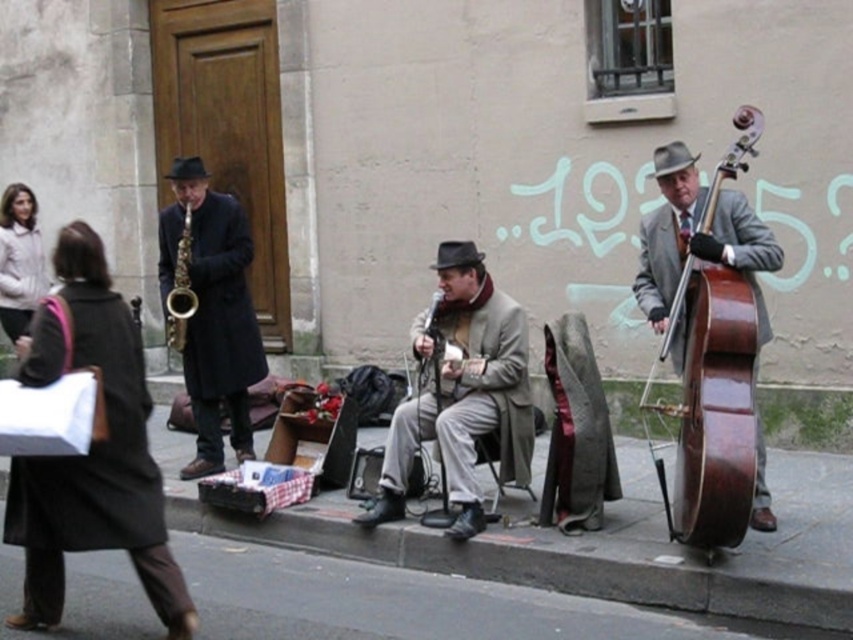
Does point (253, 451) come behind point (178, 346)?

Yes, point (253, 451) is behind point (178, 346).

Is shiny gold saxophone at left positioned behind gold metallic saxophone at left?

Yes, shiny gold saxophone at left is behind gold metallic saxophone at left.

This screenshot has width=853, height=640. What do you see at coordinates (213, 312) in the screenshot?
I see `shiny gold saxophone at left` at bounding box center [213, 312].

Locate an element on the screen. shiny gold saxophone at left is located at coordinates (213, 312).

Consider the image. Between smooth asphalt pavement at lower center and shiny gold saxophone at left, which one has less height?

smooth asphalt pavement at lower center is shorter.

Is smooth asphalt pavement at lower center above shiny gold saxophone at left?

No.

Between point (575, 547) and point (198, 260), which one is positioned behind?

The point (198, 260) is more distant.

Where is `smooth asphalt pavement at lower center`? This screenshot has height=640, width=853. smooth asphalt pavement at lower center is located at coordinates (608, 545).

Does point (229, 522) lie in front of point (177, 326)?

Yes.

Can you confirm if smooth asphalt pavement at lower center is bigger than gold metallic saxophone at left?

Indeed, smooth asphalt pavement at lower center has a larger size compared to gold metallic saxophone at left.

Where is `smooth asphalt pavement at lower center`? smooth asphalt pavement at lower center is located at coordinates (608, 545).